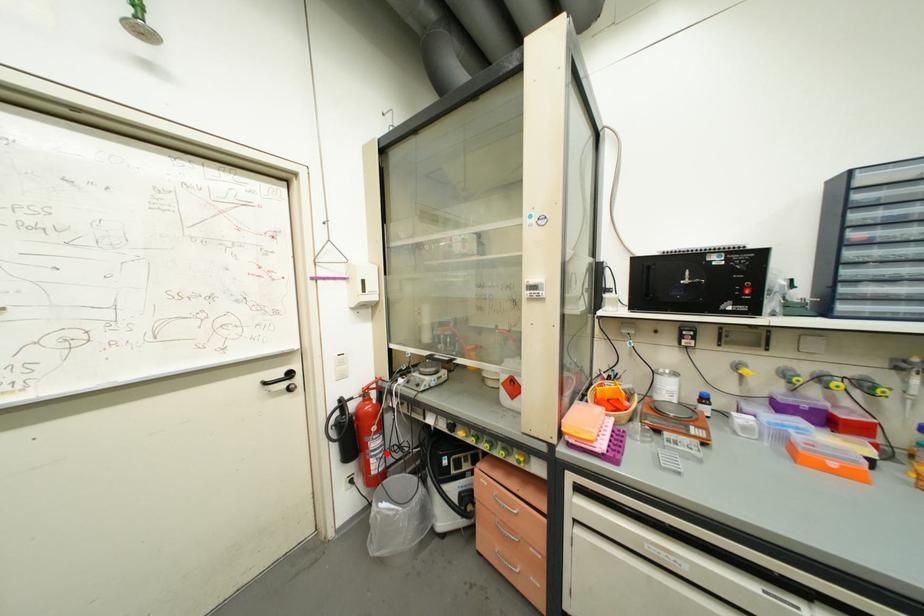
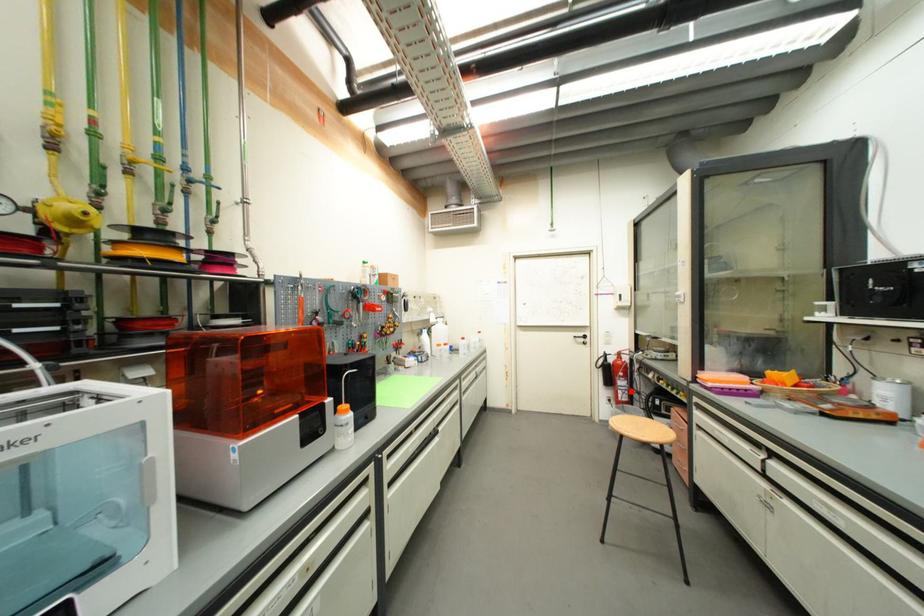
I am providing you with two images of the same scene from different viewpoints. A red point is marked on the first image and another point is marked on the second image. Do the highlighted points in image1 and image2 indicate the same real-world spot?

Yes